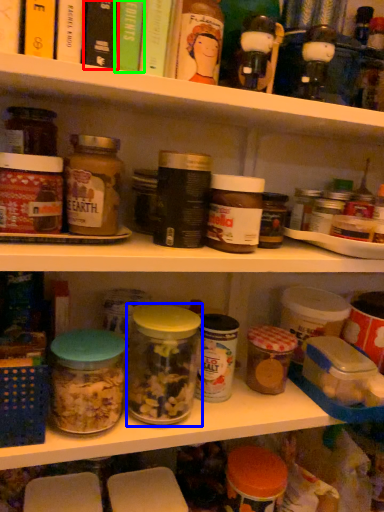
Question: Which object is the closest to the book (highlighted by a red box)? Choose among these: glass jar (highlighted by a blue box) or book (highlighted by a green box).

Choices:
 (A) glass jar
 (B) book

Answer: (B)